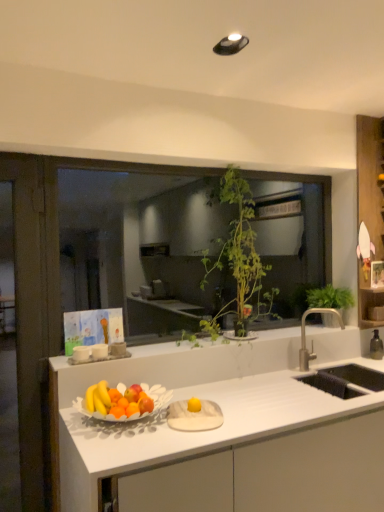
Image resolution: width=384 pixels, height=512 pixels. Find the location of `free space to the back side of silver metallic faucet at right`. free space to the back side of silver metallic faucet at right is located at coordinates (322, 370).